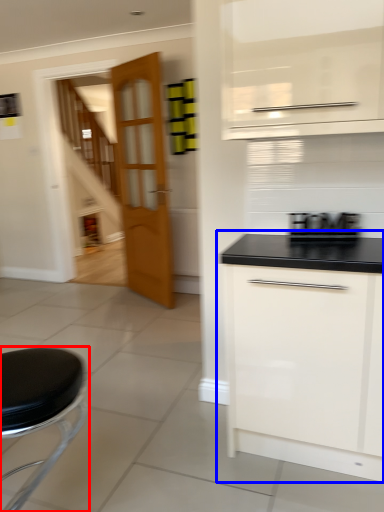
Question: Which of the following is the farthest to the observer, furniture (highlighted by a red box) or cabinetry (highlighted by a blue box)?

Choices:
 (A) furniture
 (B) cabinetry

Answer: (B)